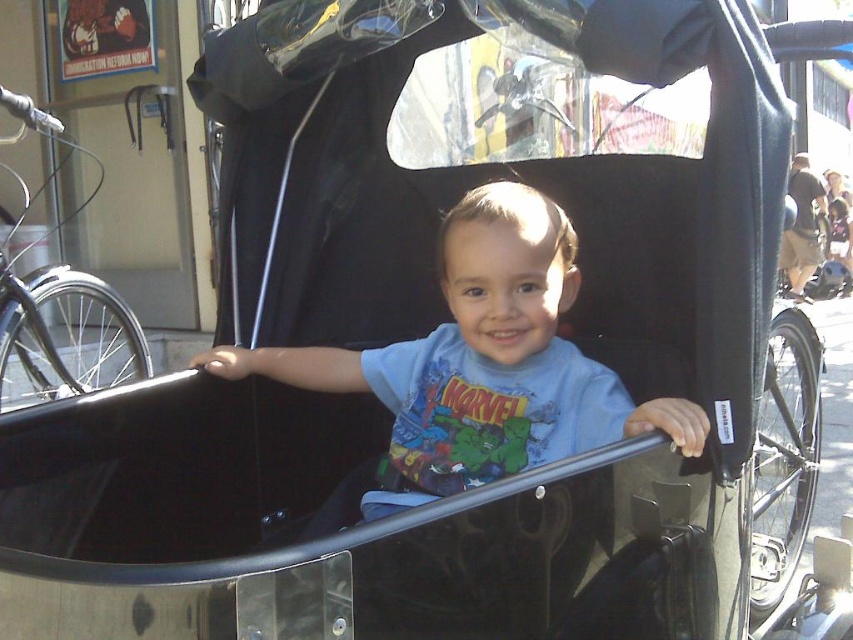
You are a photographer trying to capture a clear shot of the light blue cotton shirt at center and the brown fabric coach at right. Which object should you focus on first to ensure both are in focus?

You should focus on the light blue cotton shirt at center first since it is closer to the viewer than the brown fabric coach at right, allowing the camera to adjust focus starting from the nearest object.

You are a photographer trying to capture the child in the pedicab. Since the light blue cotton shirt at center and the brown fabric coach at right are in the frame, which one should you focus on if you want to highlight the smaller object?

The light blue cotton shirt at center is smaller than the brown fabric coach at right, so you should focus on the light blue cotton shirt at center to highlight the smaller object.

You are a photographer trying to capture a photo of the child in the pedicab. You notice the light blue cotton shirt at center and the brown fabric coach at right. Which object is closer to the camera?

The light blue cotton shirt at center is closer to the camera because it is positioned under the brown fabric coach at right, indicating it is in front.